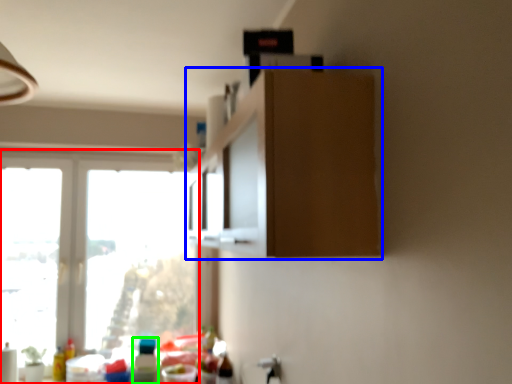
Question: Considering the real-world distances, which object is closest to window (highlighted by a red box)? cabinetry (highlighted by a blue box) or bottle (highlighted by a green box).

Choices:
 (A) cabinetry
 (B) bottle

Answer: (B)